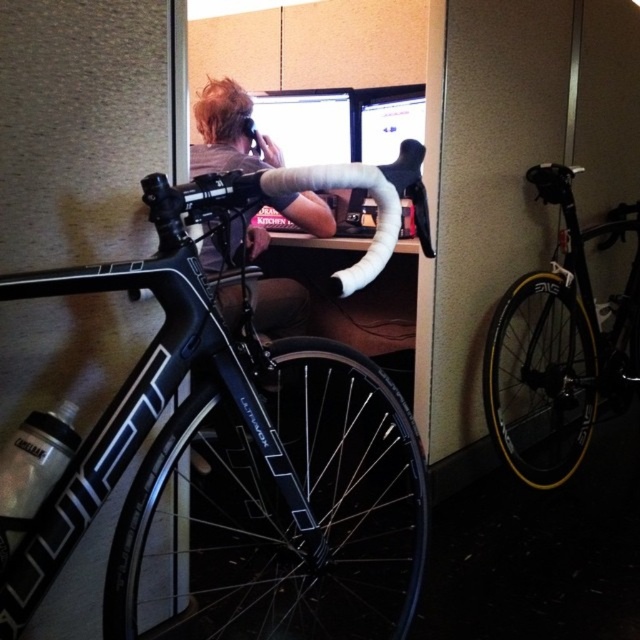
Between black matte road bike at center and blonde hair at upper center, which one is positioned lower?

black matte road bike at center

Which is more to the right, black matte road bike at center or blonde hair at upper center?

black matte road bike at center is more to the right.

Is point (177, 326) more distant than point (237, 243)?

No.

Locate an element on the screen. This screenshot has width=640, height=640. black matte road bike at center is located at coordinates pos(243,448).

Who is positioned more to the left, black matte road bike at center or black matte road bike at right?

black matte road bike at center

Is point (140, 417) positioned in front of point (580, 403)?

Yes, point (140, 417) is in front of point (580, 403).

Locate an element on the screen. The width and height of the screenshot is (640, 640). black matte road bike at center is located at coordinates (243, 448).

You are a GUI agent. You are given a task and a screenshot of the screen. Output one action in this format:
    pyautogui.click(x=<x>, y=<y>)
    Task: Click on the black matte road bike at right
    The image size is (640, 640).
    Given the screenshot: What is the action you would take?
    pyautogui.click(x=561, y=346)

Which is more to the left, black matte road bike at right or blonde hair at upper center?

blonde hair at upper center is more to the left.

Locate an element on the screen. This screenshot has width=640, height=640. black matte road bike at right is located at coordinates (561, 346).